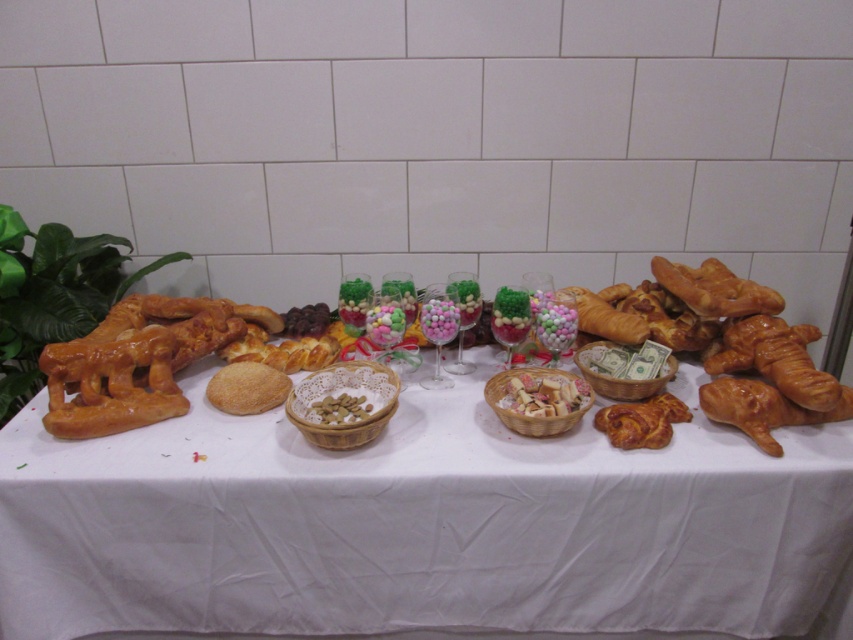
Does point (770, 531) lie behind point (177, 333)?

No, it is not.

Between white cloth at center and golden brown pretzel at left, which one has less height?

golden brown pretzel at left

At what (x,y) coordinates should I click in order to perform the action: click on white cloth at center. Please return your answer as a coordinate pair (x, y). The image size is (853, 640). Looking at the image, I should click on (416, 524).

In order to click on white cloth at center in this screenshot , I will do `click(416, 524)`.

Does golden glazed pretzels at left appear on the right side of multicolored sugar-coated candies at center?

Yes, golden glazed pretzels at left is to the right of multicolored sugar-coated candies at center.

Does golden glazed pretzels at left lie behind multicolored sugar-coated candies at center?

No, golden glazed pretzels at left is closer to the viewer.

Locate an element on the screen. golden glazed pretzels at left is located at coordinates (757, 337).

Does white cloth at center have a greater width compared to golden matte bread at center?

Correct, the width of white cloth at center exceeds that of golden matte bread at center.

Is the position of white cloth at center less distant than that of golden matte bread at center?

Yes, white cloth at center is in front of golden matte bread at center.

Between point (447, 429) and point (231, 365), which one is positioned behind?

The point (231, 365) is behind.

Image resolution: width=853 pixels, height=640 pixels. Identify the location of white cloth at center. (416, 524).